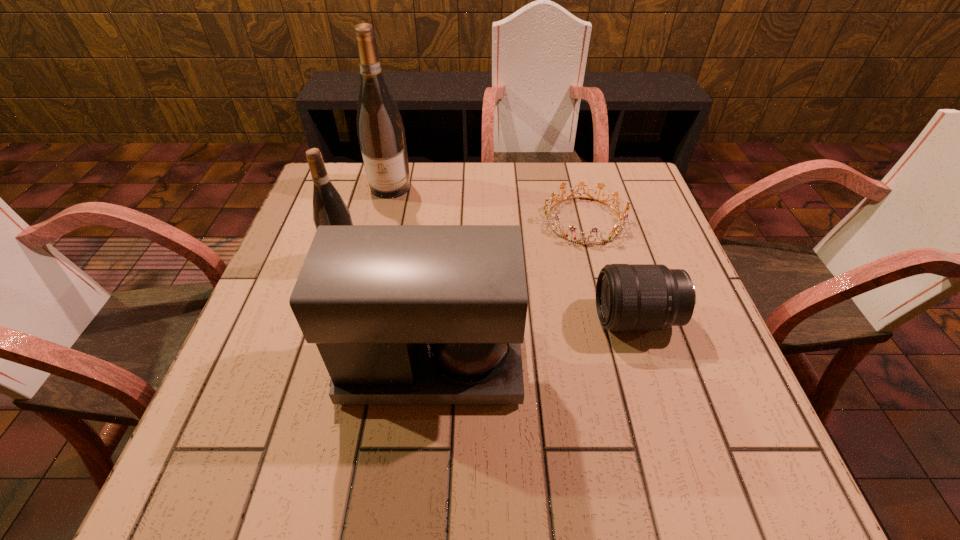
Locate an element on the screen. The height and width of the screenshot is (540, 960). object at the far left corner is located at coordinates (381, 134).

Locate an element on the screen. The height and width of the screenshot is (540, 960). object present at the far right corner is located at coordinates (618, 230).

I want to click on free space at the far edge of the desktop, so click(448, 169).

Image resolution: width=960 pixels, height=540 pixels. I want to click on vacant space at the near edge of the desktop, so 650,446.

In the image, there is a desktop. Find the location of `vacant space at the right edge`. vacant space at the right edge is located at coordinates (635, 247).

Image resolution: width=960 pixels, height=540 pixels. What are the coordinates of `free point between the coffee maker and the fourth tallest object` in the screenshot? It's located at (534, 341).

At what (x,y) coordinates should I click in order to perform the action: click on free spot between the coffee maker and the telephoto lens. Please return your answer as a coordinate pair (x, y). Looking at the image, I should click on [534, 341].

Select which object appears as the third closest to the coffee maker. Please provide its 2D coordinates. Your answer should be formatted as a tuple, i.e. [(x, y)], where the tuple contains the x and y coordinates of a point satisfying the conditions above.

[(618, 230)]

Find the location of a particular element. The image size is (960, 540). object that is the second closest to the coffee maker is located at coordinates (629, 297).